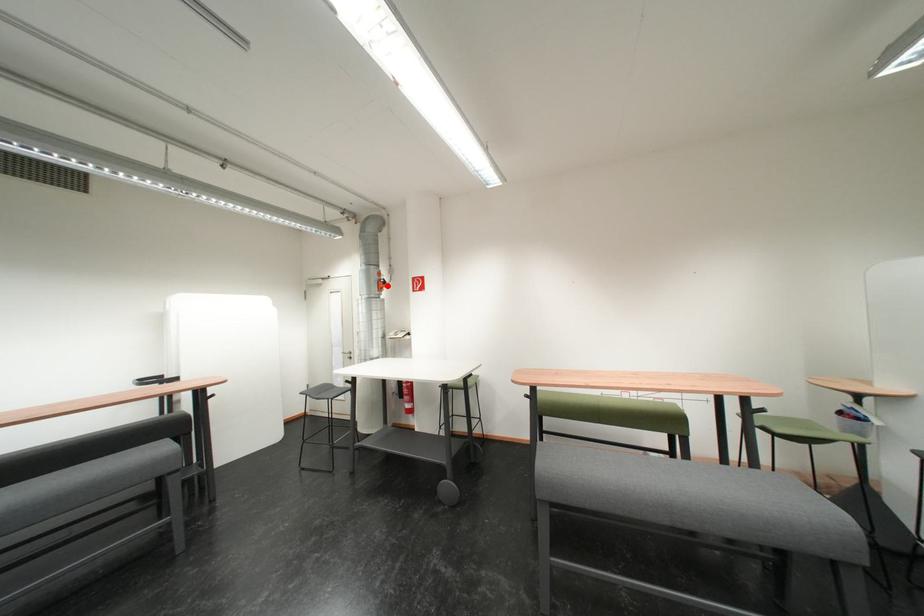
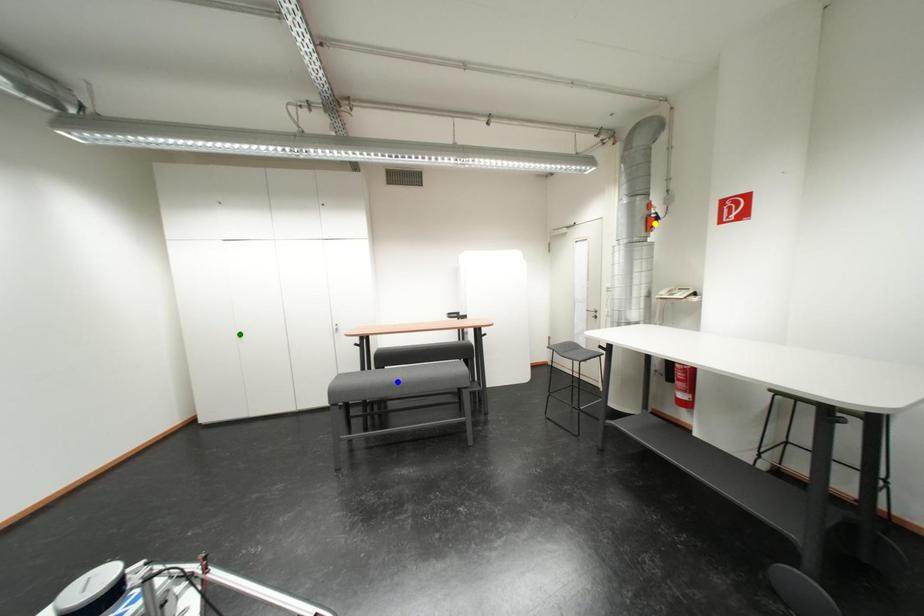
Question: I am providing you with two images of the same scene from different viewpoints. A red point is marked on the first image. You are given multiple points on the second image. Can you choose the point in image 2 that corresponds to the point in image 1?

Choices:
 (A) green point
 (B) yellow point
 (C) blue point

Answer: (B)